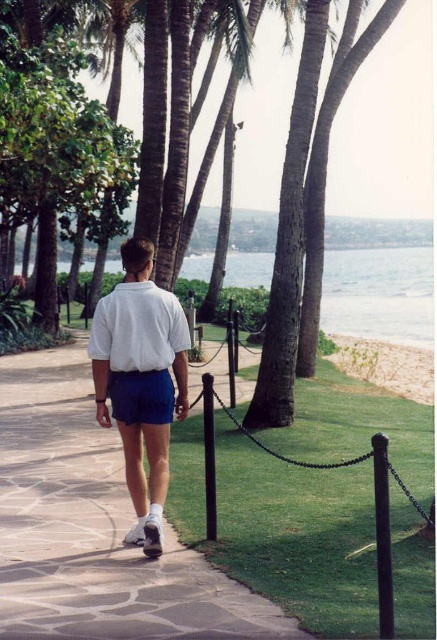
You are a tourist who wants to reach the clear blue water at center. You are currently standing on the smooth stone pavement at center. Which direction should you move to get to the water?

The smooth stone pavement at center is to the left of clear blue water at center, so you should move to the right to reach the water.